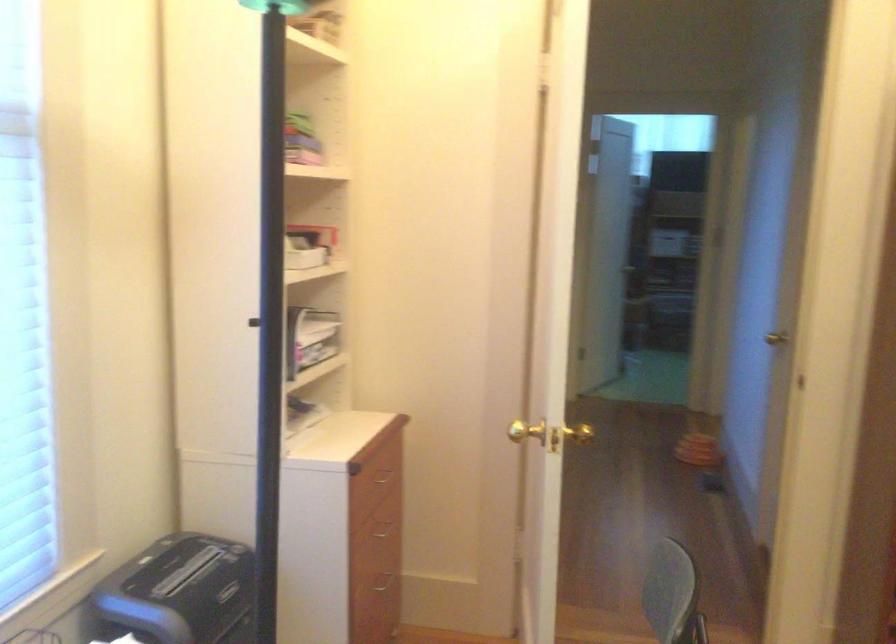
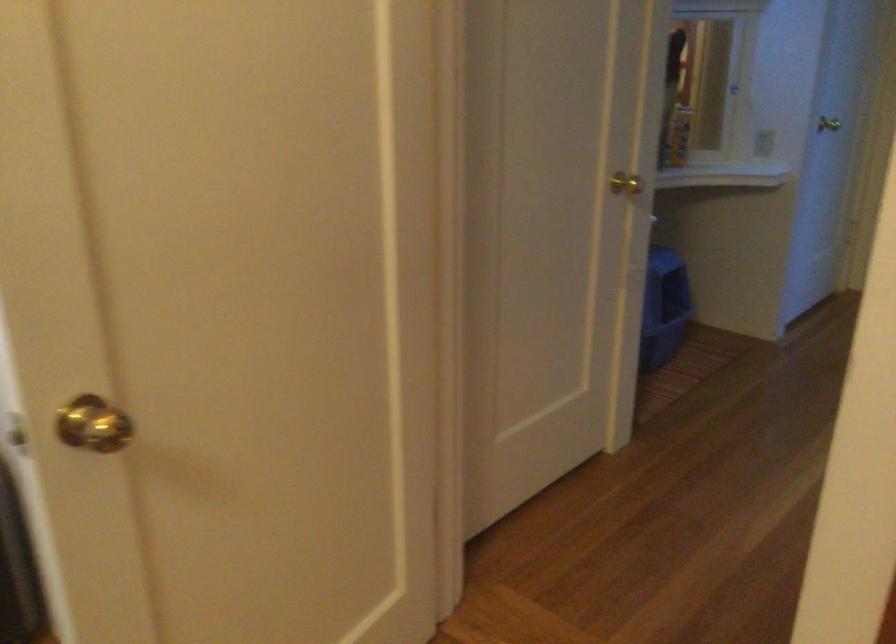
What movement of the cameraman would produce the second image?

The cameraman walked toward right, forward.